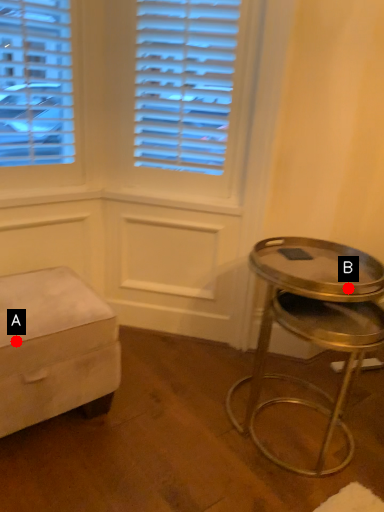
Question: Two points are circled on the image, labeled by A and B beside each circle. Which point is further to the camera?

Choices:
 (A) A is further
 (B) B is further

Answer: (A)